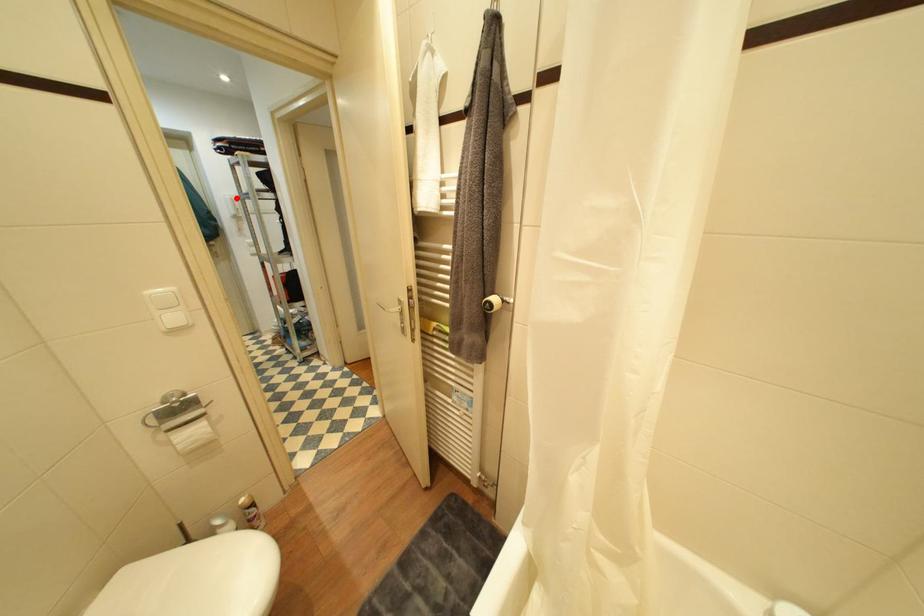
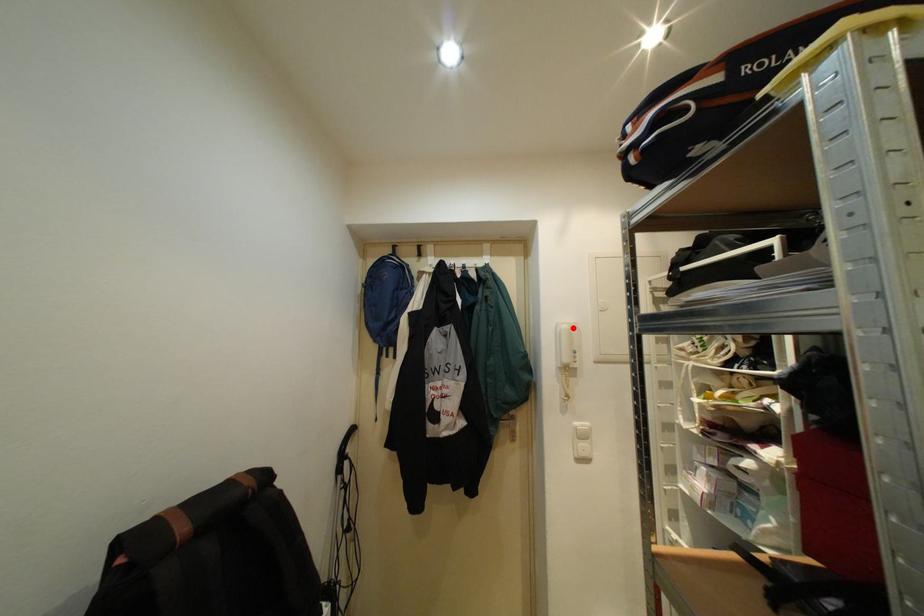
I am providing you with two images of the same scene from different viewpoints. A red point is marked on the first image and another point is marked on the second image. Are the points marked in image1 and image2 representing the same 3D position?

Yes